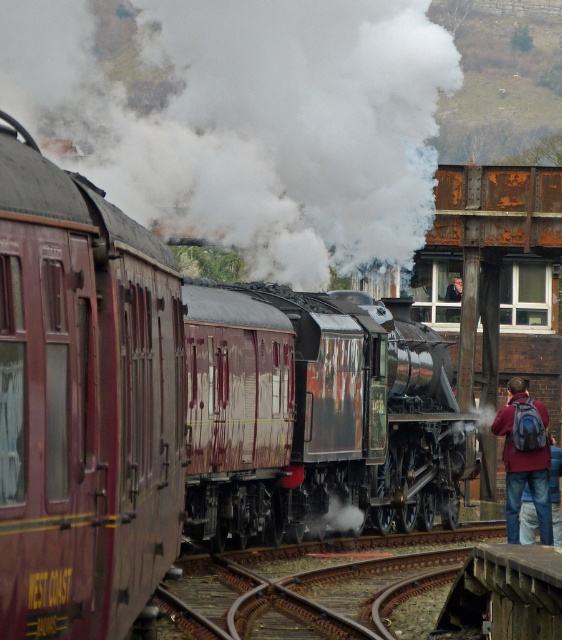
Question: Does maroon polished wood train at center have a lesser width compared to white vapor at center?

Choices:
 (A) yes
 (B) no

Answer: (A)

Question: Which of the following is the closest to the observer?

Choices:
 (A) (284, 272)
 (B) (556, 483)
 (C) (160, 298)
 (D) (545, 428)

Answer: (C)

Question: Is maroon polished wood passenger train at left bigger than denim jacket at lower right?

Choices:
 (A) no
 (B) yes

Answer: (A)

Question: Which object is positioned farthest from the maroon polished wood passenger train at left?

Choices:
 (A) white vapor at center
 (B) maroon polished wood train at center

Answer: (A)

Question: Is white vapor at center smaller than maroon polished wood passenger train at left?

Choices:
 (A) no
 (B) yes

Answer: (A)

Question: Which object is positioned farthest from the maroon polished wood passenger train at left?

Choices:
 (A) denim jacket at lower right
 (B) maroon polished wood train at center
 (C) blue backpack at lower right
 (D) white vapor at center

Answer: (D)